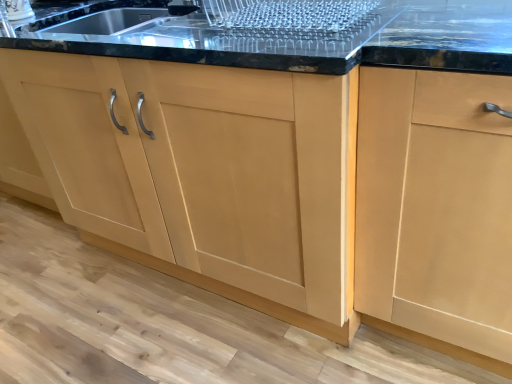
What do you see at coordinates (205, 174) in the screenshot? The width and height of the screenshot is (512, 384). I see `light wood cabinet at center, acting as the 1th cabinetry starting from the left` at bounding box center [205, 174].

The image size is (512, 384). In order to click on light wood cabinet at center, acting as the 1th cabinetry starting from the left in this screenshot , I will do `click(205, 174)`.

How much space does light wood cabinet at center, acting as the 1th cabinetry starting from the left, occupy vertically?

light wood cabinet at center, acting as the 1th cabinetry starting from the left, is 34.94 inches tall.

What do you see at coordinates (435, 206) in the screenshot?
I see `matte wood cabinet at right, which ranks as the 2th cabinetry in left-to-right order` at bounding box center [435, 206].

At what (x,y) coordinates should I click in order to perform the action: click on matte wood cabinet at right, which is the first cabinetry from right to left. Please return your answer as a coordinate pair (x, y). This screenshot has width=512, height=384. Looking at the image, I should click on (435, 206).

This screenshot has height=384, width=512. Identify the location of light wood cabinet at center, which appears as the second cabinetry when viewed from the right. (205, 174).

Does light wood cabinet at center, which appears as the second cabinetry when viewed from the right, appear on the right side of matte wood cabinet at right, which ranks as the 2th cabinetry in left-to-right order?

No.

Considering the positions of objects light wood cabinet at center, acting as the 1th cabinetry starting from the left, and matte wood cabinet at right, which ranks as the 2th cabinetry in left-to-right order, in the image provided, who is in front, light wood cabinet at center, acting as the 1th cabinetry starting from the left, or matte wood cabinet at right, which ranks as the 2th cabinetry in left-to-right order,?

matte wood cabinet at right, which ranks as the 2th cabinetry in left-to-right order, is in front.

Is point (330, 78) closer to camera compared to point (508, 256)?

Yes, it is in front of point (508, 256).

From the image's perspective, is light wood cabinet at center, acting as the 1th cabinetry starting from the left, beneath matte wood cabinet at right, which is the first cabinetry from right to left?

Incorrect, from the image's perspective, light wood cabinet at center, acting as the 1th cabinetry starting from the left, is higher than matte wood cabinet at right, which is the first cabinetry from right to left.

From a real-world perspective, is light wood cabinet at center, which appears as the second cabinetry when viewed from the right, physically below matte wood cabinet at right, which is the first cabinetry from right to left?

No, from a real-world perspective, light wood cabinet at center, which appears as the second cabinetry when viewed from the right, is not under matte wood cabinet at right, which is the first cabinetry from right to left.

Based on the photo, is light wood cabinet at center, acting as the 1th cabinetry starting from the left, wider than matte wood cabinet at right, which is the first cabinetry from right to left?

Yes, light wood cabinet at center, acting as the 1th cabinetry starting from the left, is wider than matte wood cabinet at right, which is the first cabinetry from right to left.

Between light wood cabinet at center, acting as the 1th cabinetry starting from the left, and matte wood cabinet at right, which is the first cabinetry from right to left, which one has less height?

light wood cabinet at center, acting as the 1th cabinetry starting from the left.

Which of these two, light wood cabinet at center, acting as the 1th cabinetry starting from the left, or matte wood cabinet at right, which is the first cabinetry from right to left, is smaller?

matte wood cabinet at right, which is the first cabinetry from right to left, is smaller.

Is matte wood cabinet at right, which ranks as the 2th cabinetry in left-to-right order, inside light wood cabinet at center, which appears as the second cabinetry when viewed from the right?

No, light wood cabinet at center, which appears as the second cabinetry when viewed from the right, does not contain matte wood cabinet at right, which ranks as the 2th cabinetry in left-to-right order.

Are light wood cabinet at center, which appears as the second cabinetry when viewed from the right, and matte wood cabinet at right, which ranks as the 2th cabinetry in left-to-right order, making contact?

No, light wood cabinet at center, which appears as the second cabinetry when viewed from the right, is not with matte wood cabinet at right, which ranks as the 2th cabinetry in left-to-right order.

Is light wood cabinet at center, which appears as the second cabinetry when viewed from the right, oriented towards matte wood cabinet at right, which is the first cabinetry from right to left?

No, light wood cabinet at center, which appears as the second cabinetry when viewed from the right, is not turned towards matte wood cabinet at right, which is the first cabinetry from right to left.

What's the angular difference between light wood cabinet at center, acting as the 1th cabinetry starting from the left, and matte wood cabinet at right, which ranks as the 2th cabinetry in left-to-right order,'s facing directions?

The angular difference between light wood cabinet at center, acting as the 1th cabinetry starting from the left, and matte wood cabinet at right, which ranks as the 2th cabinetry in left-to-right order, is 6.97e-05 degrees.

The width and height of the screenshot is (512, 384). What are the coordinates of `cabinetry above the matte wood cabinet at right, which ranks as the 2th cabinetry in left-to-right order (from the image's perspective)` in the screenshot? It's located at (205, 174).

Is matte wood cabinet at right, which is the first cabinetry from right to left, at the left side of light wood cabinet at center, which appears as the second cabinetry when viewed from the right?

No, matte wood cabinet at right, which is the first cabinetry from right to left, is not to the left of light wood cabinet at center, which appears as the second cabinetry when viewed from the right.

Considering the positions of objects matte wood cabinet at right, which ranks as the 2th cabinetry in left-to-right order, and light wood cabinet at center, which appears as the second cabinetry when viewed from the right, in the image provided, who is behind, matte wood cabinet at right, which ranks as the 2th cabinetry in left-to-right order, or light wood cabinet at center, which appears as the second cabinetry when viewed from the right,?

Positioned behind is light wood cabinet at center, which appears as the second cabinetry when viewed from the right.

Considering the points (475, 153) and (239, 218), which point is in front, point (475, 153) or point (239, 218)?

The point (475, 153) is closer.

From the image's perspective, is matte wood cabinet at right, which is the first cabinetry from right to left, below light wood cabinet at center, which appears as the second cabinetry when viewed from the right?

Yes, from the image's perspective, matte wood cabinet at right, which is the first cabinetry from right to left, is below light wood cabinet at center, which appears as the second cabinetry when viewed from the right.

From a real-world perspective, is matte wood cabinet at right, which ranks as the 2th cabinetry in left-to-right order, above or below light wood cabinet at center, acting as the 1th cabinetry starting from the left?

Clearly, from a real-world perspective, matte wood cabinet at right, which ranks as the 2th cabinetry in left-to-right order, is below light wood cabinet at center, acting as the 1th cabinetry starting from the left.

Which object is wider, matte wood cabinet at right, which is the first cabinetry from right to left, or light wood cabinet at center, which appears as the second cabinetry when viewed from the right?

light wood cabinet at center, which appears as the second cabinetry when viewed from the right, is wider.

Does matte wood cabinet at right, which is the first cabinetry from right to left, have a lesser height compared to light wood cabinet at center, acting as the 1th cabinetry starting from the left?

No.

Consider the image. Between matte wood cabinet at right, which is the first cabinetry from right to left, and light wood cabinet at center, which appears as the second cabinetry when viewed from the right, which one has smaller size?

matte wood cabinet at right, which is the first cabinetry from right to left.

Is light wood cabinet at center, which appears as the second cabinetry when viewed from the right, completely or partially inside matte wood cabinet at right, which ranks as the 2th cabinetry in left-to-right order?

Definitely not — light wood cabinet at center, which appears as the second cabinetry when viewed from the right, is not inside matte wood cabinet at right, which ranks as the 2th cabinetry in left-to-right order.

Are matte wood cabinet at right, which ranks as the 2th cabinetry in left-to-right order, and light wood cabinet at center, acting as the 1th cabinetry starting from the left, making contact?

No, matte wood cabinet at right, which ranks as the 2th cabinetry in left-to-right order, is not next to light wood cabinet at center, acting as the 1th cabinetry starting from the left.

Does matte wood cabinet at right, which ranks as the 2th cabinetry in left-to-right order, turn towards light wood cabinet at center, acting as the 1th cabinetry starting from the left?

No, matte wood cabinet at right, which ranks as the 2th cabinetry in left-to-right order, is not facing towards light wood cabinet at center, acting as the 1th cabinetry starting from the left.

How different are the orientations of matte wood cabinet at right, which is the first cabinetry from right to left, and light wood cabinet at center, acting as the 1th cabinetry starting from the left, in degrees?

The angular difference between matte wood cabinet at right, which is the first cabinetry from right to left, and light wood cabinet at center, acting as the 1th cabinetry starting from the left, is 6.97e-05 degrees.

Locate an element on the screen. The image size is (512, 384). cabinetry above the matte wood cabinet at right, which ranks as the 2th cabinetry in left-to-right order (from a real-world perspective) is located at coordinates (205, 174).

Find the location of a particular element. Image resolution: width=512 pixels, height=384 pixels. cabinetry behind the matte wood cabinet at right, which is the first cabinetry from right to left is located at coordinates tap(205, 174).

You are a GUI agent. You are given a task and a screenshot of the screen. Output one action in this format:
    pyautogui.click(x=<x>, y=<y>)
    Task: Click on the cabinetry below the light wood cabinet at center, which appears as the second cabinetry when viewed from the right (from a real-world perspective)
    This screenshot has height=384, width=512.
    Given the screenshot: What is the action you would take?
    pyautogui.click(x=435, y=206)